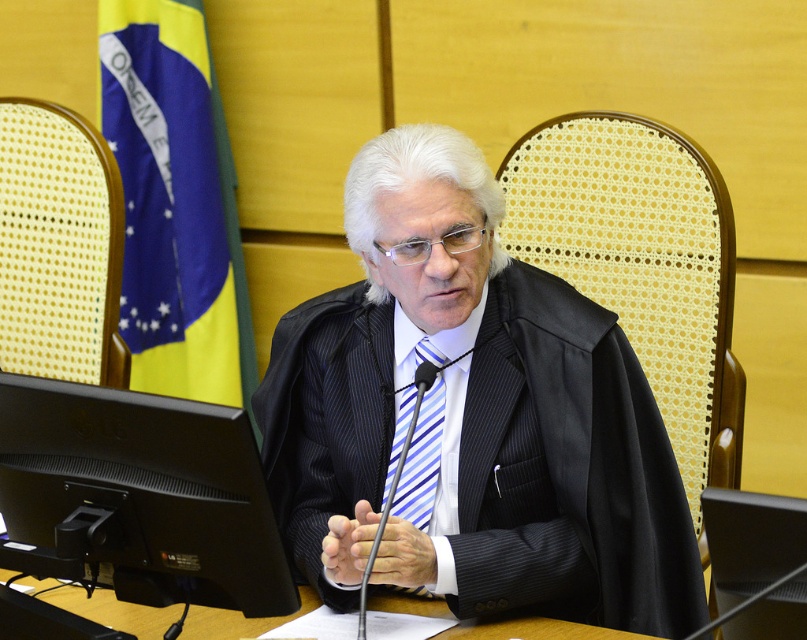
Who is lower down, black glossy monitor at lower left or blue striped tie at center?

Positioned lower is black glossy monitor at lower left.

The width and height of the screenshot is (807, 640). In order to click on black glossy monitor at lower left in this screenshot , I will do `click(141, 493)`.

Where is `black glossy monitor at lower left`? black glossy monitor at lower left is located at coordinates (141, 493).

Is the position of black glossy monitor at lower left less distant than that of blue fabric flag at upper left?

Yes, it is.

This screenshot has width=807, height=640. What do you see at coordinates (141, 493) in the screenshot?
I see `black glossy monitor at lower left` at bounding box center [141, 493].

The image size is (807, 640). What are the coordinates of `black glossy monitor at lower left` in the screenshot? It's located at (141, 493).

Who is lower down, blue fabric flag at upper left or wooden table at center?

wooden table at center is below.

Which is in front, point (149, 106) or point (274, 624)?

Point (274, 624) is more forward.

Is point (207, 176) closer to camera compared to point (554, 637)?

That is False.

Image resolution: width=807 pixels, height=640 pixels. I want to click on blue fabric flag at upper left, so click(174, 202).